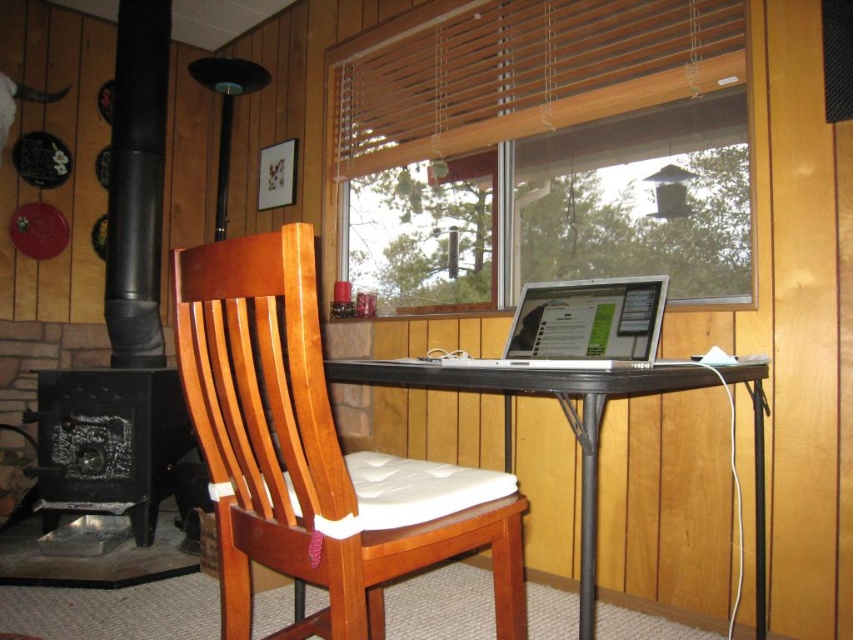
Does black cast iron fireplace at lower left have a greater width compared to black metal table at center?

No, black cast iron fireplace at lower left is not wider than black metal table at center.

Is black cast iron fireplace at lower left thinner than black metal table at center?

Indeed, black cast iron fireplace at lower left has a lesser width compared to black metal table at center.

This screenshot has height=640, width=853. What do you see at coordinates (108, 444) in the screenshot? I see `black cast iron fireplace at lower left` at bounding box center [108, 444].

Where is `black cast iron fireplace at lower left`? black cast iron fireplace at lower left is located at coordinates (108, 444).

Can you confirm if black metal table at center is positioned to the left of silver metallic laptop at center?

Correct, you'll find black metal table at center to the left of silver metallic laptop at center.

Which is more to the left, black metal table at center or silver metallic laptop at center?

black metal table at center

What do you see at coordinates (585, 428) in the screenshot? This screenshot has width=853, height=640. I see `black metal table at center` at bounding box center [585, 428].

This screenshot has width=853, height=640. What are the coordinates of `black metal table at center` in the screenshot? It's located at (585, 428).

Does point (248, 579) come closer to viewer compared to point (38, 472)?

Yes, point (248, 579) is closer to viewer.

Between point (363, 504) and point (171, 417), which one is positioned behind?

The point (171, 417) is behind.

Where is `wooden chair with white cushion at center`? The height and width of the screenshot is (640, 853). wooden chair with white cushion at center is located at coordinates (314, 452).